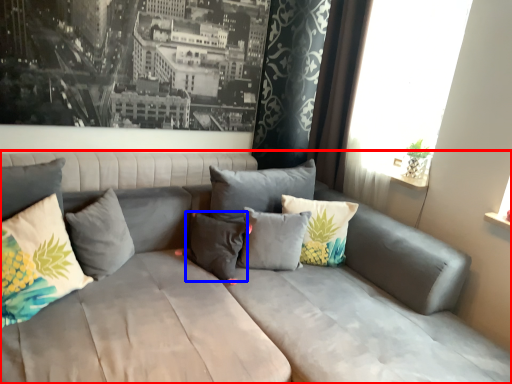
Question: Which object is further to the camera taking this photo, studio couch (highlighted by a red box) or pillow (highlighted by a blue box)?

Choices:
 (A) studio couch
 (B) pillow

Answer: (B)